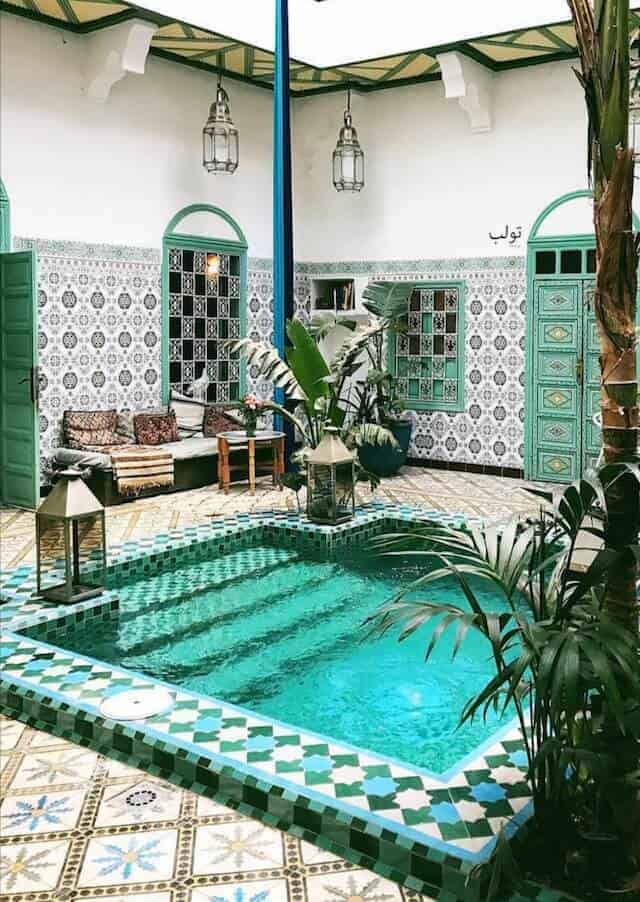
Find the location of `door handle`. door handle is located at coordinates (22, 379).